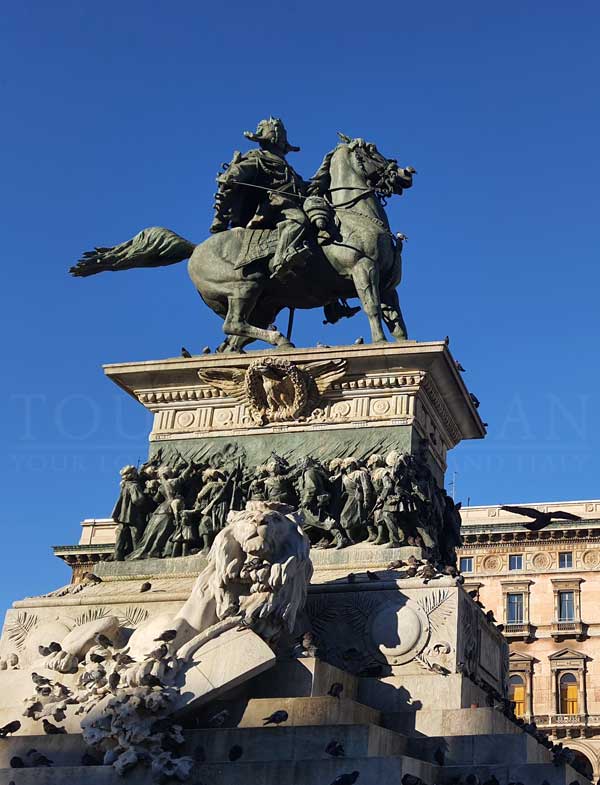
The height and width of the screenshot is (785, 600). Find the location of `wreath`. wreath is located at coordinates (300, 366), (255, 396).